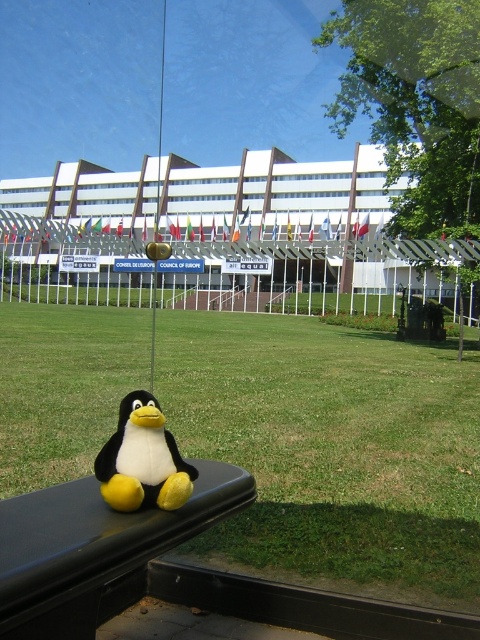
Question: Can you confirm if black plastic bench at lower left is thinner than white plush penguin at lower left?

Choices:
 (A) yes
 (B) no

Answer: (B)

Question: Which object appears closest to the camera in this image?

Choices:
 (A) black plastic bench at lower left
 (B) green grass at lower center

Answer: (A)

Question: From the image, what is the correct spatial relationship of green grass at lower center in relation to black plastic bench at lower left?

Choices:
 (A) below
 (B) above

Answer: (B)

Question: Which of the following is the farthest from the observer?

Choices:
 (A) white plush penguin at lower left
 (B) black plastic bench at lower left
 (C) green grass at lower center

Answer: (C)

Question: Can you confirm if green grass at lower center is positioned above white plush penguin at lower left?

Choices:
 (A) yes
 (B) no

Answer: (A)

Question: Considering the real-world distances, which object is closest to the green grass at lower center?

Choices:
 (A) black plastic bench at lower left
 (B) white plush penguin at lower left

Answer: (A)